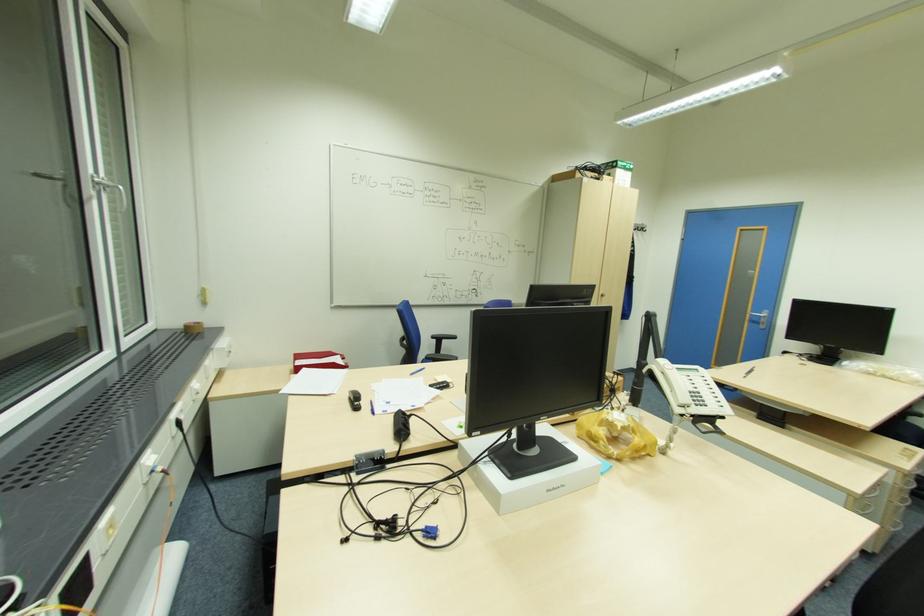
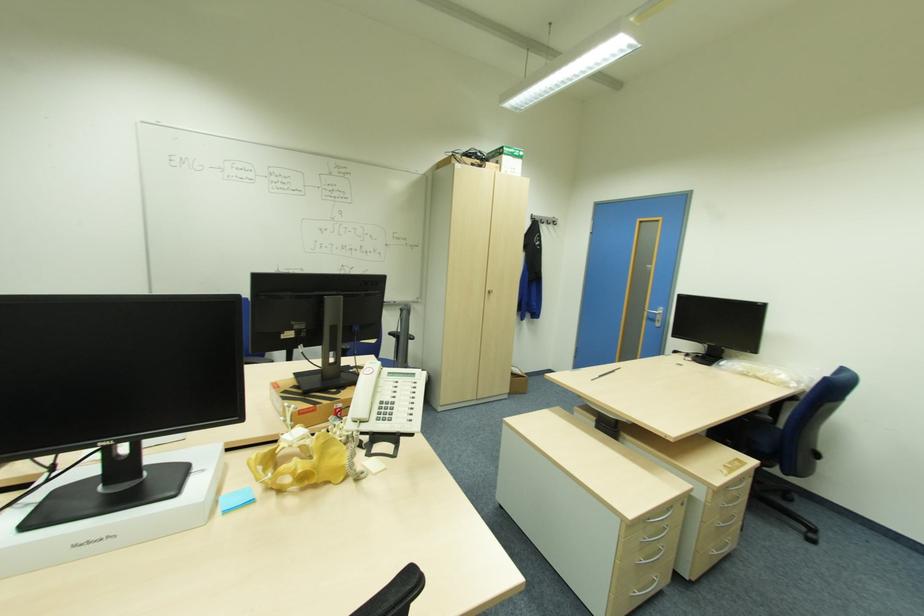
The point at (621, 459) is marked in the first image. Where is the corresponding point in the second image?

(283, 490)